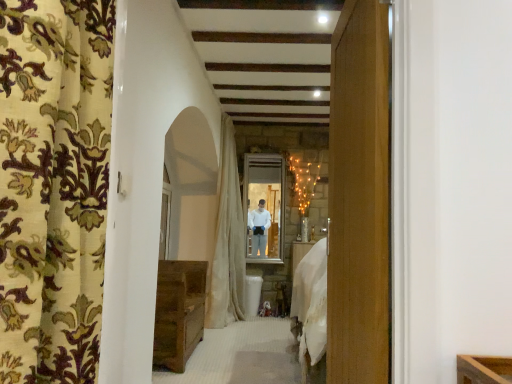
Question: Considering the relative positions of clear glass window at center, which is counted as the second window, starting from the front, and white textured curtain at center, which is counted as the second curtain, starting from the front, in the image provided, is clear glass window at center, which is counted as the second window, starting from the front, to the left or to the right of white textured curtain at center, which is counted as the second curtain, starting from the front,?

Choices:
 (A) right
 (B) left

Answer: (A)

Question: Relative to white textured curtain at center, which is counted as the second curtain, starting from the front, is clear glass window at center, which is counted as the second window, starting from the front, in front or behind?

Choices:
 (A) front
 (B) behind

Answer: (B)

Question: Estimate the real-world distances between objects in this image. Which object is farther from the floral fabric curtain at left, the 2th curtain positioned from the back?

Choices:
 (A) rustic wood chest at lower left
 (B) clear glass window at center, which appears as the second window when viewed from the back
 (C) clear glass window at center, which ranks as the second window in left-to-right order
 (D) white textured curtain at center, which is counted as the second curtain, starting from the front

Answer: (C)

Question: Which object is the farthest from the white textured curtain at center, which is counted as the second curtain, starting from the front?

Choices:
 (A) floral fabric curtain at left, the 2th curtain positioned from the back
 (B) clear glass window at center, marked as the 1th window in a front-to-back arrangement
 (C) clear glass window at center, marked as the 1th window in a right-to-left arrangement
 (D) rustic wood chest at lower left

Answer: (A)